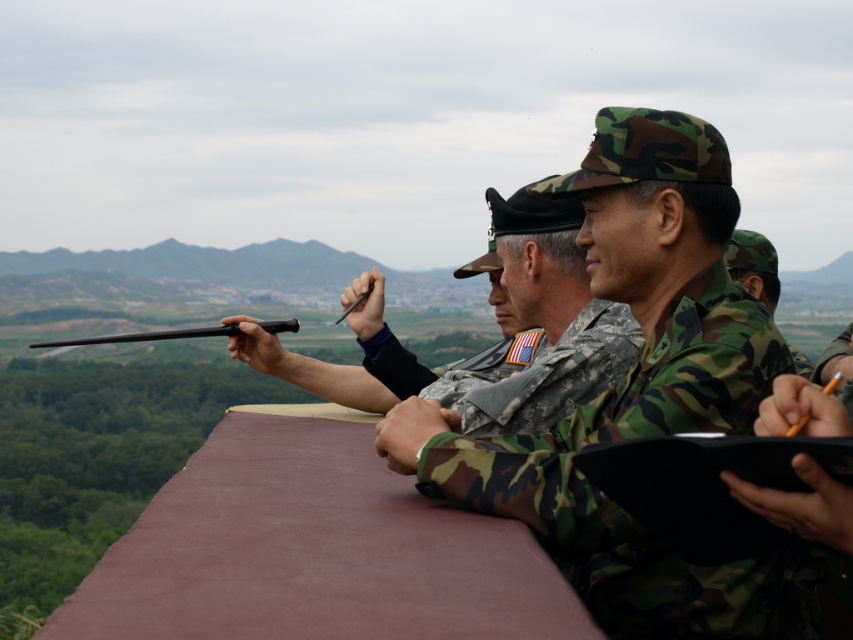
Looking at this image, you are a photographer planning to take a group photo of the camo fabric uniform at center and the camo uniform at center. Which of the two should you position closer to the camera to ensure both appear equally wide in the photo?

You should position the camo uniform at center closer to the camera because the camo fabric uniform at center might be wider than camo uniform at center, so moving the narrower one forward will help balance their apparent widths.

You are a military recruit observing the scene. You need to determine which object is taller between the camo uniform at center and the black matte gun at center. Based on the scene, which one is taller?

The camo uniform at center is much taller than the black matte gun at center according to the description.

You are a military planner who needs to set up a communication line between the two individuals wearing camo fabric uniform at center and camo uniform at center. What is the minimum length of the communication line required?

The minimum length of the communication line required between the camo fabric uniform at center and the camo uniform at center is 4.05 meters, as they are 4.05 meters apart.